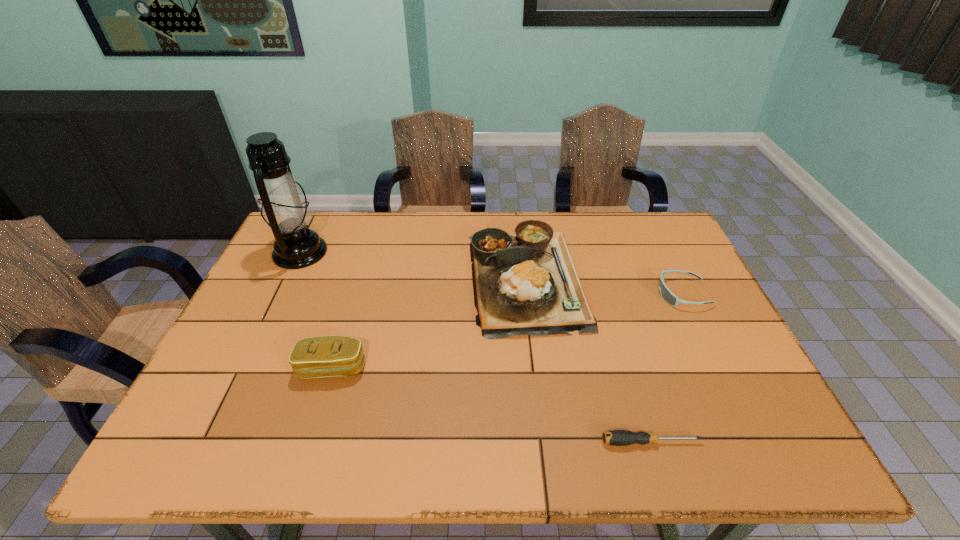
Where is `oil lamp`? Image resolution: width=960 pixels, height=540 pixels. oil lamp is located at coordinates (285, 210).

The image size is (960, 540). I want to click on the leftmost object, so click(285, 210).

Where is `platter`? This screenshot has height=540, width=960. platter is located at coordinates (526, 283).

The height and width of the screenshot is (540, 960). I want to click on the fourth farthest object, so click(x=322, y=356).

I want to click on clutch bag, so click(x=322, y=356).

Where is `the rightmost object`? This screenshot has height=540, width=960. the rightmost object is located at coordinates (666, 294).

Where is `goggles`? This screenshot has height=540, width=960. goggles is located at coordinates (666, 294).

Where is `the nearest object`? Image resolution: width=960 pixels, height=540 pixels. the nearest object is located at coordinates 615,437.

Where is `screwdriver`? This screenshot has width=960, height=540. screwdriver is located at coordinates (615, 437).

At what (x,y) coordinates should I click in order to perform the action: click on free spot located 0.060m on the right of the oil lamp. Please return your answer as a coordinate pair (x, y). Image resolution: width=960 pixels, height=540 pixels. Looking at the image, I should click on coord(346,253).